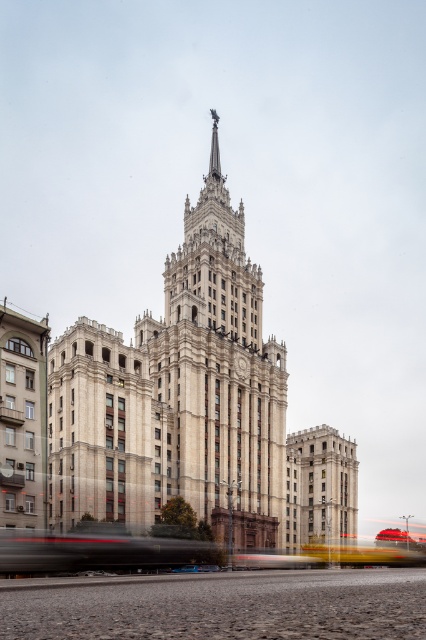
Question: Is white stone church at center closer to the viewer compared to smooth stone tower at center?

Choices:
 (A) yes
 (B) no

Answer: (A)

Question: Which object appears farthest from the camera in this image?

Choices:
 (A) white stone church at center
 (B) smooth stone tower at center

Answer: (B)

Question: Can you confirm if white stone church at center is positioned to the left of smooth stone tower at center?

Choices:
 (A) yes
 (B) no

Answer: (A)

Question: Which object appears closest to the camera in this image?

Choices:
 (A) smooth stone tower at center
 (B) white stone church at center

Answer: (B)

Question: Can you confirm if white stone church at center is positioned above smooth stone tower at center?

Choices:
 (A) yes
 (B) no

Answer: (A)